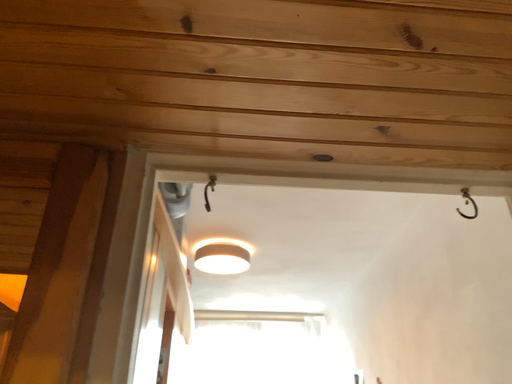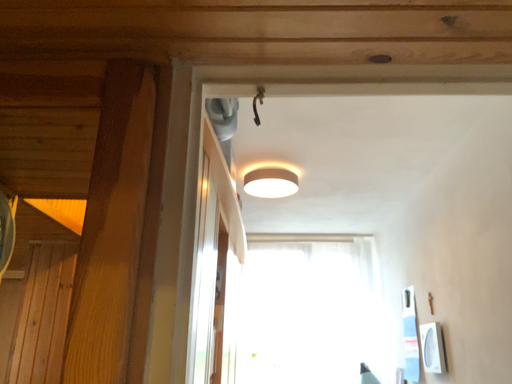
Question: Which way did the camera rotate in the video?

Choices:
 (A) rotated upward
 (B) rotated downward

Answer: (B)